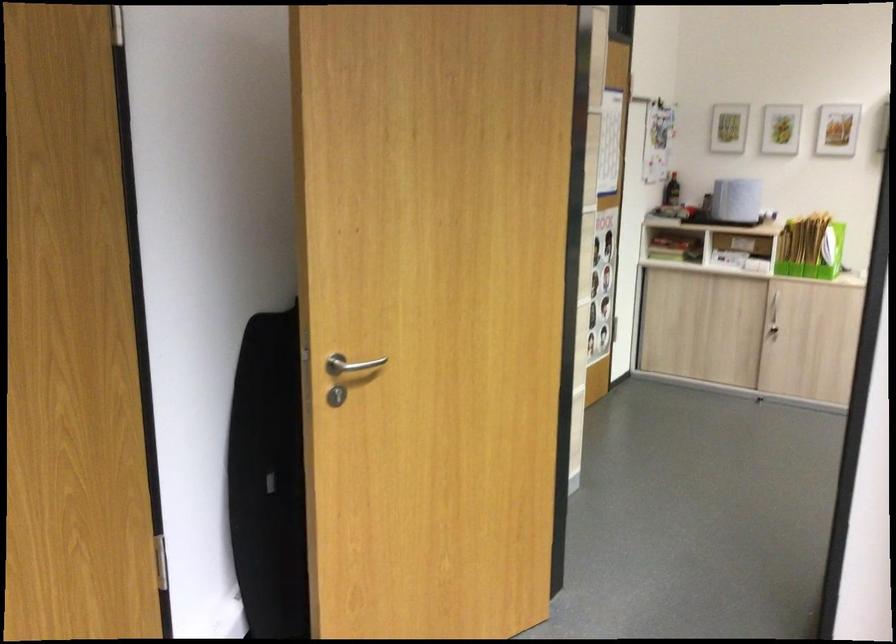
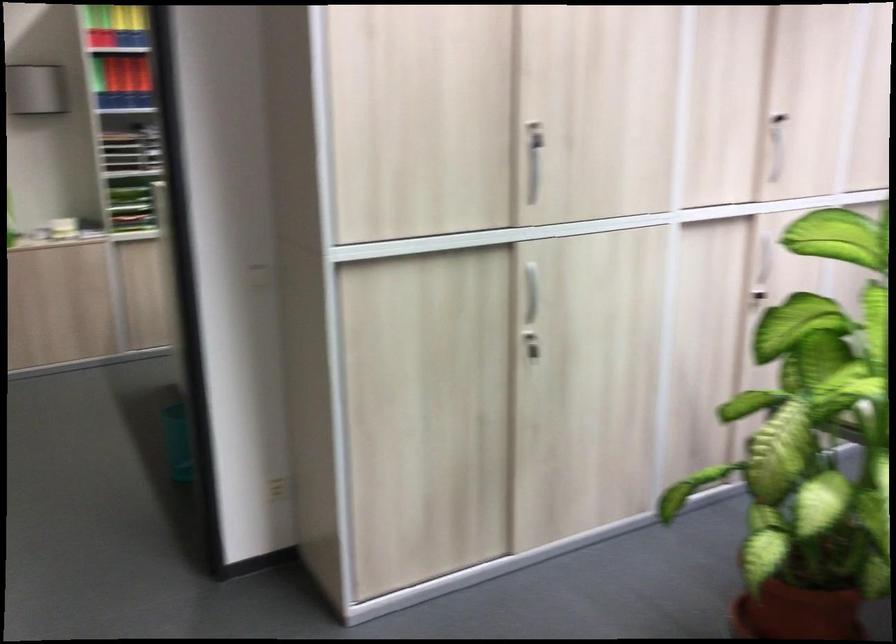
Question: The first image is from the beginning of the video and the second image is from the end. How did the camera likely rotate when shooting the video?

Choices:
 (A) Left
 (B) Right
 (C) Up
 (D) Down

Answer: (B)